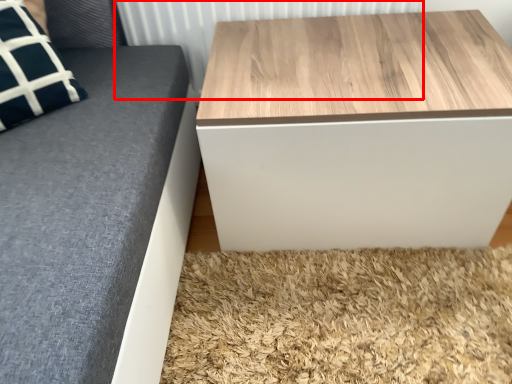
Question: Observing the image, what is the correct spatial positioning of radiator (annotated by the red box) in reference to table?

Choices:
 (A) right
 (B) left

Answer: (B)